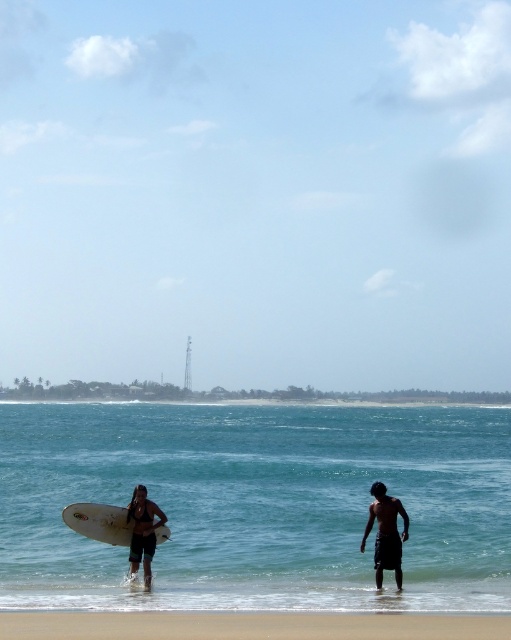
You are a photographer trying to capture the scene from the shore. You notice the dark brown skin at lower right and the white matte surfboard at lower left. Which object would appear closer to the camera based on their sizes?

The dark brown skin at lower right has a smaller size compared to the white matte surfboard at lower left, so the surfboard is closer to the camera since it appears larger.

You are a photographer trying to capture the scene from the shore. You notice the dark brown skin at lower right and the white matte surfboard at lower left. Which object is positioned higher in the image?

The dark brown skin at lower right is located above the white matte surfboard at lower left, so it is positioned higher in the image.

You are standing on the sandy beach at lower center and want to walk towards the clear blue water at center. Which direction should you move in?

Since the clear blue water at center is further to the viewer than the sandy beach at lower center, you should move forward towards the clear blue water at center as it is closer to your current position on the sandy beach at lower center.